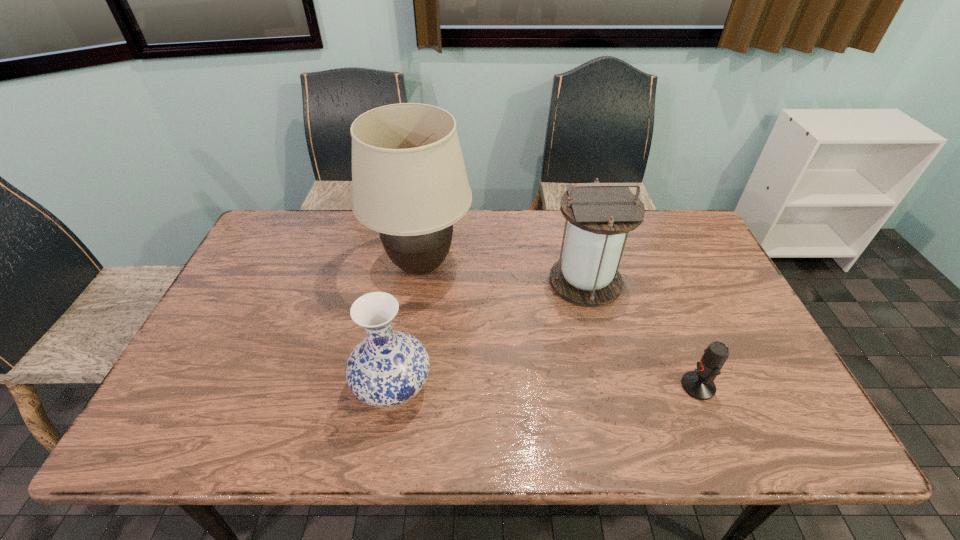
What are the coordinates of `free space between the lampshade and the lantern` in the screenshot? It's located at (503, 274).

Identify the location of vacant region between the lampshade and the vase. The width and height of the screenshot is (960, 540). (407, 327).

Identify the location of empty space between the tallest object and the third tallest object. (407, 327).

At what (x,y) coordinates should I click in order to perform the action: click on free space between the vase and the rightmost object. Please return your answer as a coordinate pair (x, y). This screenshot has width=960, height=540. Looking at the image, I should click on click(545, 387).

The width and height of the screenshot is (960, 540). Identify the location of vacant space that is in between the tallest object and the lantern. (503, 274).

Find the location of a particular element. The image size is (960, 540). vacant space in between the third shortest object and the tallest object is located at coordinates (503, 274).

At what (x,y) coordinates should I click in order to perform the action: click on free space between the tallest object and the third shortest object. Please return your answer as a coordinate pair (x, y). This screenshot has width=960, height=540. Looking at the image, I should click on (503, 274).

At what (x,y) coordinates should I click in order to perform the action: click on blank region between the tallest object and the lantern. Please return your answer as a coordinate pair (x, y). The image size is (960, 540). Looking at the image, I should click on (x=503, y=274).

Locate an element on the screen. The height and width of the screenshot is (540, 960). vacant area that lies between the tallest object and the second tallest object is located at coordinates (503, 274).

The image size is (960, 540). Identify the location of object identified as the closest to the lampshade. tap(387, 368).